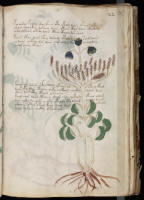
The image size is (144, 200). Identify the location of book. (76, 101).